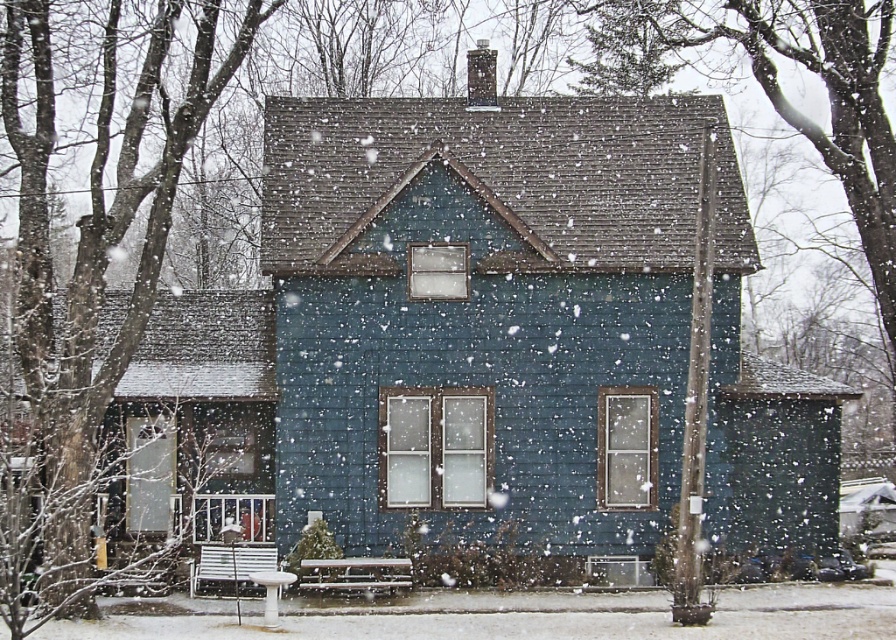
Can you confirm if metallic silver bench at lower center is positioned to the left of white plastic park bench at lower left?

Incorrect, metallic silver bench at lower center is not on the left side of white plastic park bench at lower left.

Can you confirm if metallic silver bench at lower center is positioned to the right of white plastic park bench at lower left?

Correct, you'll find metallic silver bench at lower center to the right of white plastic park bench at lower left.

Locate an element on the screen. metallic silver bench at lower center is located at coordinates pos(355,573).

Locate an element on the screen. This screenshot has width=896, height=640. metallic silver bench at lower center is located at coordinates (355, 573).